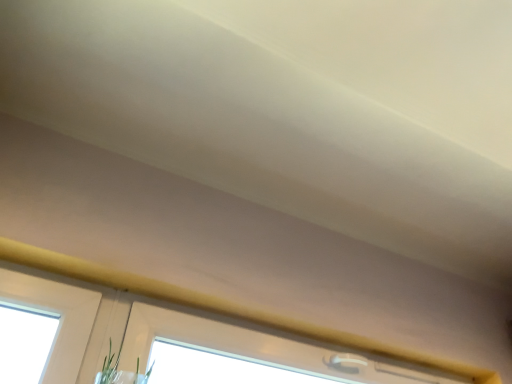
Question: Considering the positions of green matte plant at lower center and white plastic window at upper center in the image, is green matte plant at lower center taller or shorter than white plastic window at upper center?

Choices:
 (A) tall
 (B) short

Answer: (A)

Question: From a real-world perspective, is green matte plant at lower center positioned above or below white plastic window at upper center?

Choices:
 (A) below
 (B) above

Answer: (A)

Question: In the image, is green matte plant at lower center on the left side or the right side of white plastic window at upper center?

Choices:
 (A) left
 (B) right

Answer: (A)

Question: In the image, is white plastic window at upper center on the left side or the right side of green matte plant at lower center?

Choices:
 (A) right
 (B) left

Answer: (A)

Question: Based on their sizes in the image, would you say white plastic window at upper center is bigger or smaller than green matte plant at lower center?

Choices:
 (A) small
 (B) big

Answer: (A)

Question: Considering the positions of white plastic window at upper center and green matte plant at lower center in the image, is white plastic window at upper center wider or thinner than green matte plant at lower center?

Choices:
 (A) thin
 (B) wide

Answer: (B)

Question: From the image's perspective, is white plastic window at upper center located above or below green matte plant at lower center?

Choices:
 (A) above
 (B) below

Answer: (A)